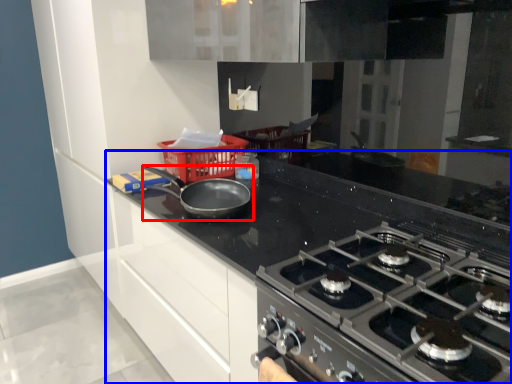
Question: Which point is closer to the camera, kitchen appliance (highlighted by a red box) or countertop (highlighted by a blue box)?

Choices:
 (A) kitchen appliance
 (B) countertop

Answer: (B)